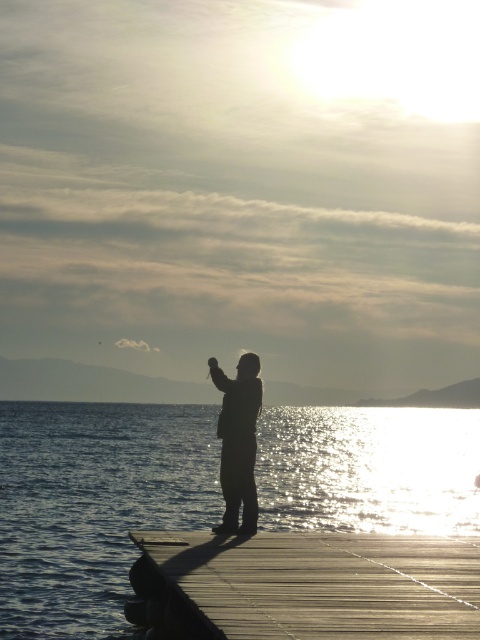
You are a photographer trying to capture the sunset at the dock. You notice the shiny blue water at center and the silhouette figure at center. Which object in the scene is taller when viewed from your camera lens?

The shiny blue water at center is taller than the silhouette figure at center according to the scene description.

You are standing at the point marked as point [324,582] on the dock. Looking around, you see the wooden planks of the dock extending towards the water. Which direction should you walk to reach the wooden planks at center?

The point [324,582] corresponds to the wooden planks at center, so you are already standing on the wooden planks at center.

You are standing on the dock and see the shiny blue water at center and the silhouette figure at center. Which object is positioned to the left of the other?

The shiny blue water at center is to the left of the silhouette figure at center.